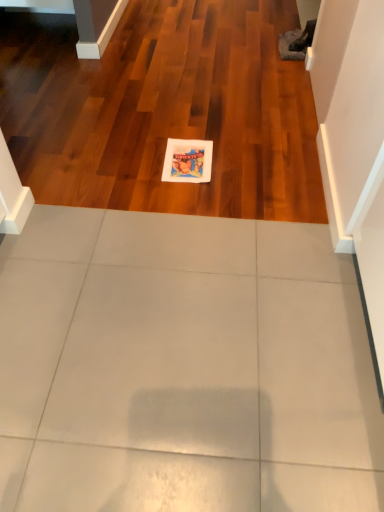
At what (x,y) coordinates should I click in order to perform the action: click on free space below matte paper postcard at center (from a real-world perspective). Please return your answer as a coordinate pair (x, y). Image resolution: width=384 pixels, height=512 pixels. Looking at the image, I should click on (187, 160).